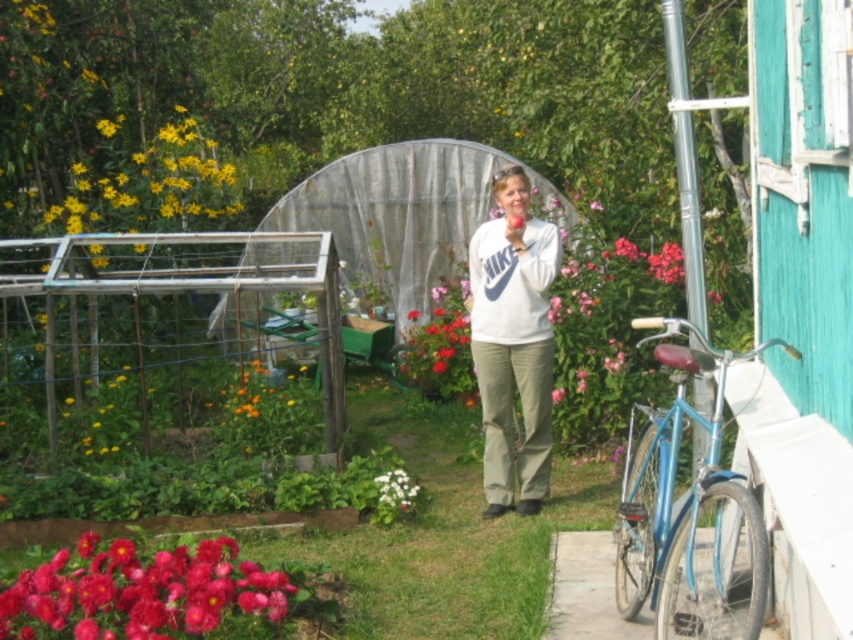
Who is higher up, blue metallic bicycle at right or matte white flower at center?

matte white flower at center

Is blue metallic bicycle at right thinner than matte white flower at center?

Yes, blue metallic bicycle at right is thinner than matte white flower at center.

Is point (711, 605) farther from camera compared to point (434, 301)?

No.

Find the location of a particular element. blue metallic bicycle at right is located at coordinates (688, 508).

Is blue metallic bicycle at right taller than white matte sweatshirt at center?

No, blue metallic bicycle at right is not taller than white matte sweatshirt at center.

This screenshot has width=853, height=640. What do you see at coordinates (688, 508) in the screenshot?
I see `blue metallic bicycle at right` at bounding box center [688, 508].

Where is `blue metallic bicycle at right`? blue metallic bicycle at right is located at coordinates (688, 508).

Identify the location of blue metallic bicycle at right. The image size is (853, 640). (688, 508).

Does white matte sweatshirt at center appear under matte white flower at center?

Yes, white matte sweatshirt at center is below matte white flower at center.

Locate an element on the screen. white matte sweatshirt at center is located at coordinates (514, 342).